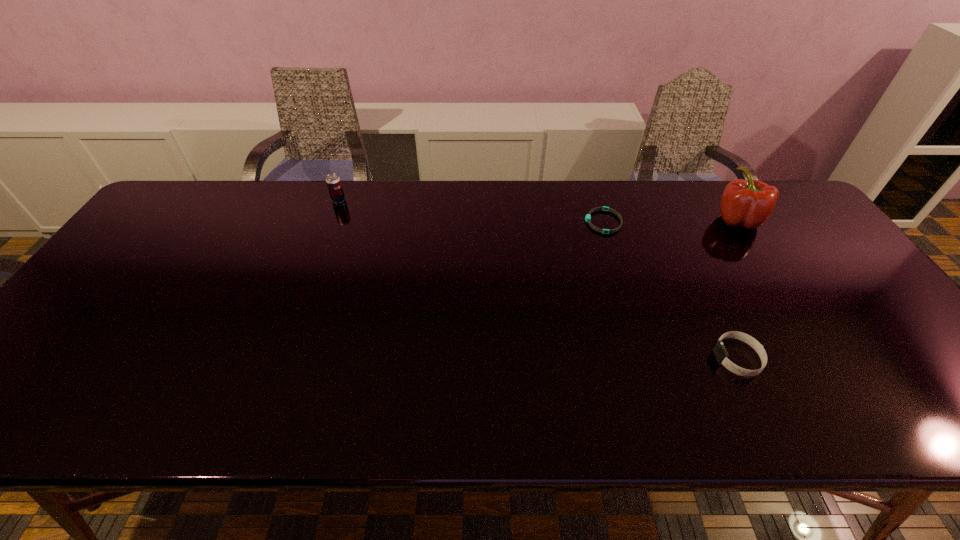
Where is `object positioned at the far right corner`? Image resolution: width=960 pixels, height=540 pixels. object positioned at the far right corner is located at coordinates (749, 203).

This screenshot has width=960, height=540. Identify the location of free space at the far edge of the desktop. (244, 219).

The width and height of the screenshot is (960, 540). Find the location of `vacant space at the near edge`. vacant space at the near edge is located at coordinates (280, 393).

Image resolution: width=960 pixels, height=540 pixels. Find the location of `vacant space at the left edge of the desktop`. vacant space at the left edge of the desktop is located at coordinates click(108, 304).

Find the location of a particular element. free space at the right edge of the desktop is located at coordinates (865, 319).

At what (x,y) coordinates should I click in order to perform the action: click on free location at the far left corner. Please return your answer as a coordinate pair (x, y). Looking at the image, I should click on (175, 212).

Find the location of a particular element. Image resolution: width=960 pixels, height=540 pixels. free region at the far right corner of the desktop is located at coordinates (782, 197).

Find the location of `unoccupied area between the nearest object and the leftmost object`. unoccupied area between the nearest object and the leftmost object is located at coordinates (539, 279).

The width and height of the screenshot is (960, 540). Identify the location of free space that is in between the farther wristband and the pepper. (670, 221).

Where is `vacant area that lies between the nearest object and the pepper`? The height and width of the screenshot is (540, 960). vacant area that lies between the nearest object and the pepper is located at coordinates (737, 289).